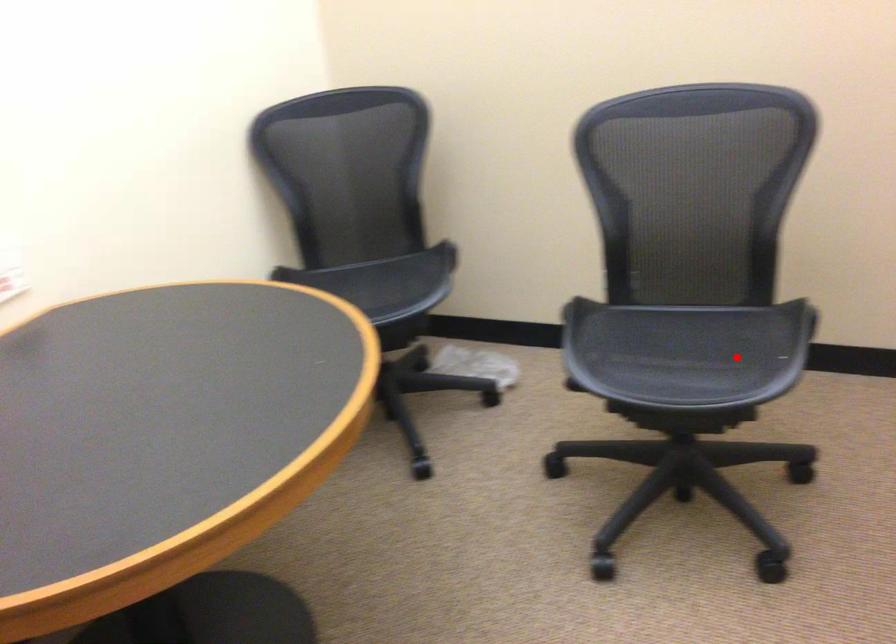
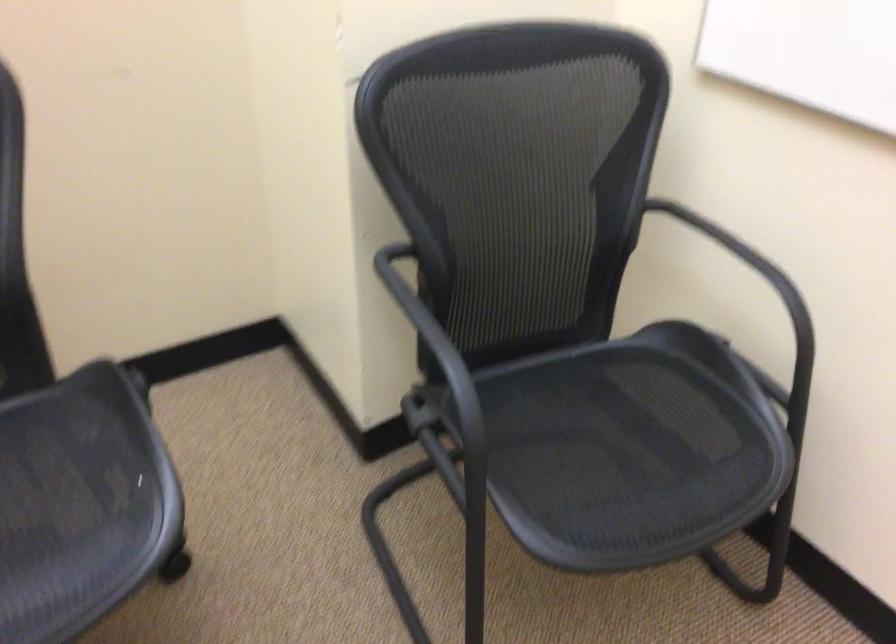
In the second image, find the point that corresponds to the highlighted location in the first image.

(80, 503)